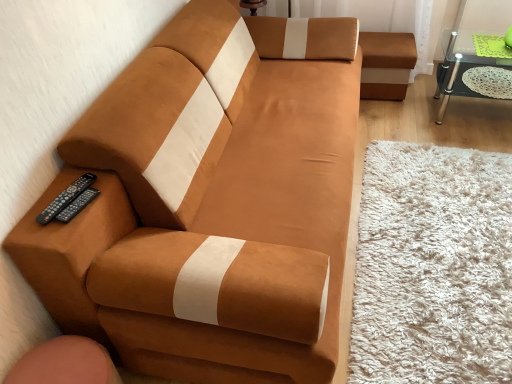
Question: Considering the relative sizes of transparent glass table at upper right and black plastic remote at lower left, which ranks as the first remote in left-to-right order, in the image provided, is transparent glass table at upper right shorter than black plastic remote at lower left, which ranks as the first remote in left-to-right order,?

Choices:
 (A) no
 (B) yes

Answer: (A)

Question: From a real-world perspective, is transparent glass table at upper right located beneath black plastic remote at lower left, which is counted as the second remote, starting from the right?

Choices:
 (A) yes
 (B) no

Answer: (A)

Question: Is transparent glass table at upper right in contact with black plastic remote at lower left, which ranks as the first remote in left-to-right order?

Choices:
 (A) yes
 (B) no

Answer: (B)

Question: Can you confirm if transparent glass table at upper right is positioned to the left of black plastic remote at lower left, which ranks as the first remote in left-to-right order?

Choices:
 (A) yes
 (B) no

Answer: (B)

Question: Is transparent glass table at upper right positioned in front of black plastic remote at lower left, which ranks as the first remote in left-to-right order?

Choices:
 (A) yes
 (B) no

Answer: (B)

Question: Considering their positions, is black plastic remote at lower left, which ranks as the first remote in left-to-right order, located in front of or behind black plastic remote at lower left, the 1th remote when ordered from right to left?

Choices:
 (A) front
 (B) behind

Answer: (B)

Question: From the image's perspective, is black plastic remote at lower left, which ranks as the first remote in left-to-right order, above or below black plastic remote at lower left, positioned as the second remote in left-to-right order?

Choices:
 (A) below
 (B) above

Answer: (B)

Question: Based on their sizes in the image, would you say black plastic remote at lower left, which is counted as the second remote, starting from the right, is bigger or smaller than black plastic remote at lower left, positioned as the second remote in left-to-right order?

Choices:
 (A) small
 (B) big

Answer: (B)

Question: In terms of width, does black plastic remote at lower left, which is counted as the second remote, starting from the right, look wider or thinner when compared to black plastic remote at lower left, positioned as the second remote in left-to-right order?

Choices:
 (A) wide
 (B) thin

Answer: (A)

Question: Is point (31, 263) positioned closer to the camera than point (440, 107)?

Choices:
 (A) farther
 (B) closer

Answer: (B)

Question: From a real-world perspective, is suede-like brown couch at left physically located above or below transparent glass table at upper right?

Choices:
 (A) above
 (B) below

Answer: (A)

Question: From the image's perspective, is suede-like brown couch at left located above or below transparent glass table at upper right?

Choices:
 (A) below
 (B) above

Answer: (A)

Question: Relative to transparent glass table at upper right, is suede-like brown couch at left in front or behind?

Choices:
 (A) front
 (B) behind

Answer: (A)

Question: From their relative heights in the image, would you say black plastic remote at lower left, which ranks as the first remote in left-to-right order, is taller or shorter than transparent glass table at upper right?

Choices:
 (A) tall
 (B) short

Answer: (B)

Question: Choose the correct answer: Is black plastic remote at lower left, which is counted as the second remote, starting from the right, inside transparent glass table at upper right or outside it?

Choices:
 (A) inside
 (B) outside

Answer: (B)